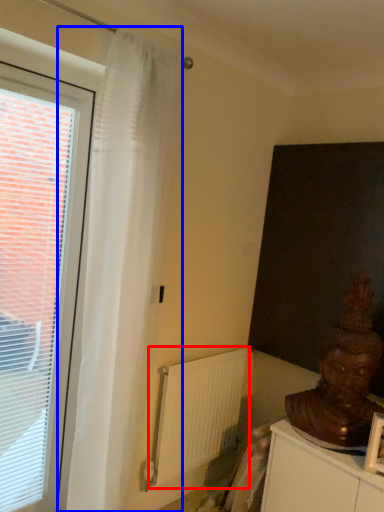
Question: Which point is closer to the camera, radiator (highlighted by a red box) or curtain (highlighted by a blue box)?

Choices:
 (A) radiator
 (B) curtain

Answer: (B)